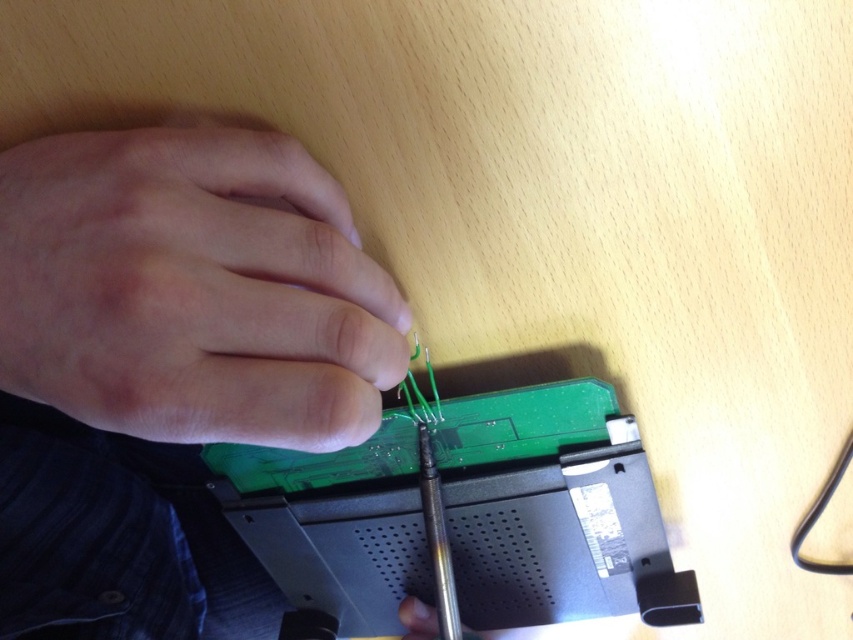
Does skinny white hand at upper left have a lesser height compared to matte black hand at center?

No, skinny white hand at upper left is not shorter than matte black hand at center.

From the picture: How much distance is there between skinny white hand at upper left and matte black hand at center?

skinny white hand at upper left and matte black hand at center are 9.85 inches apart from each other.

Is point (184, 205) closer to camera compared to point (410, 596)?

That is True.

I want to click on skinny white hand at upper left, so click(x=192, y=289).